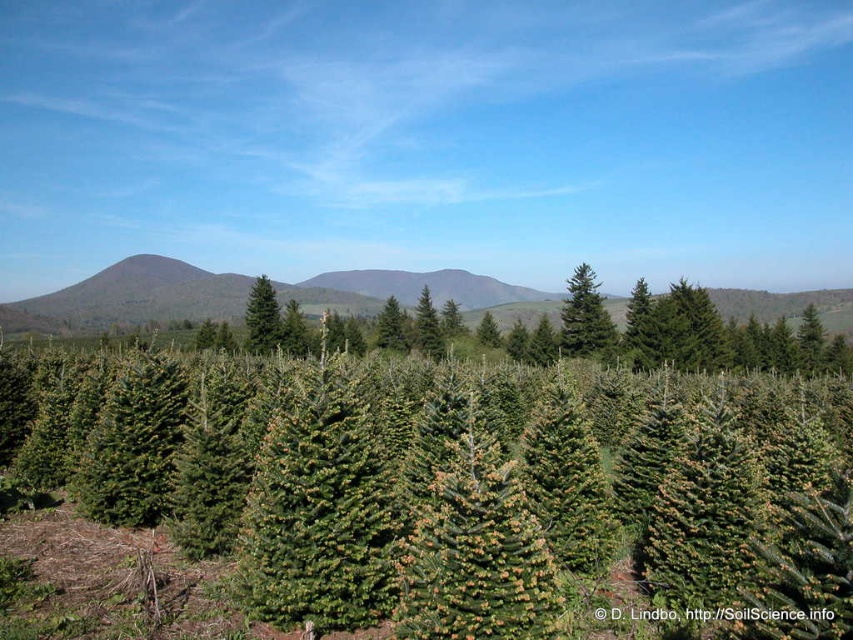
You are a hiker standing at the edge of the landscape looking towards the center. You see the green matte forest at center and the green matte evergreen tree at center. Which one is higher in your line of sight?

The green matte forest at center is higher in your line of sight because it is positioned above the green matte evergreen tree at center according to the description.